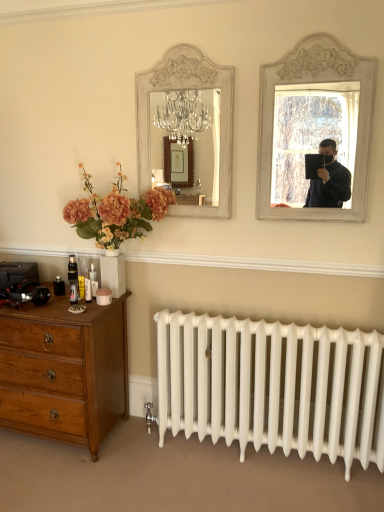
Identify the location of free region under white painted wood mirror at upper right (from a real-world perspective). The height and width of the screenshot is (512, 384). (302, 253).